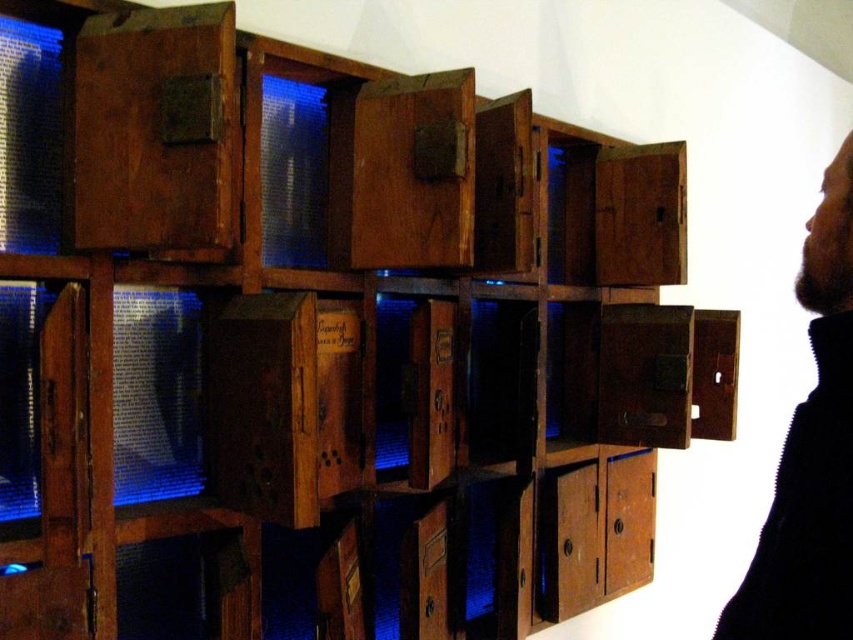
Which is more to the right, bearded black sweater at right or rustic wood drawer at lower right?

From the viewer's perspective, rustic wood drawer at lower right appears more on the right side.

Based on the photo, is bearded black sweater at right further to the viewer compared to rustic wood drawer at lower right?

That is False.

Locate an element on the screen. The width and height of the screenshot is (853, 640). bearded black sweater at right is located at coordinates (811, 452).